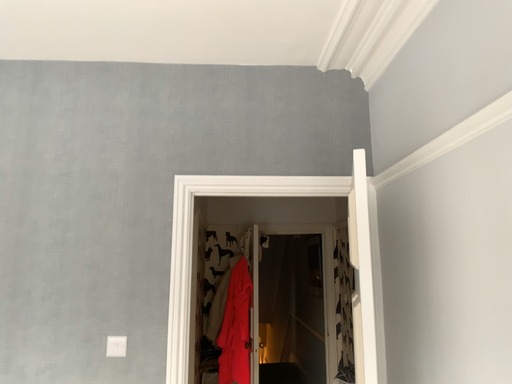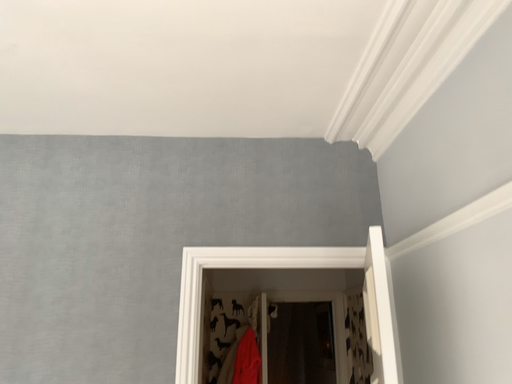
Question: How did the camera likely rotate when shooting the video?

Choices:
 (A) rotated upward
 (B) rotated downward

Answer: (A)